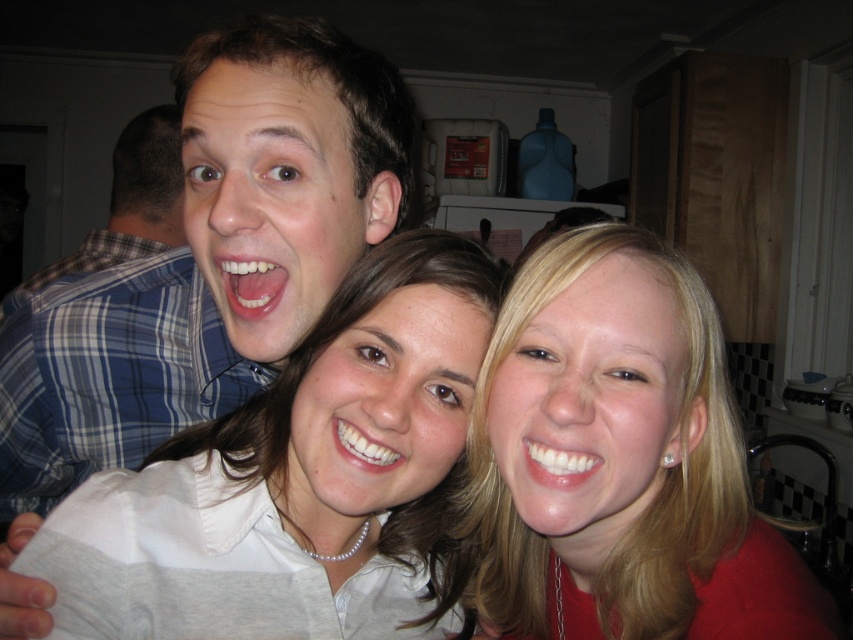
Question: From the image, what is the correct spatial relationship of white pearl necklace at center in relation to blue plaid shirt at left?

Choices:
 (A) below
 (B) above

Answer: (A)

Question: Which of the following is the farthest from the observer?

Choices:
 (A) (119, 228)
 (B) (115, 371)
 (C) (563, 289)
 (D) (437, 492)

Answer: (A)

Question: Is white matte shirt at upper left above white pearl necklace at center?

Choices:
 (A) no
 (B) yes

Answer: (B)

Question: Which object is positioned closest to the white pearl necklace at center?

Choices:
 (A) blonde hair at center
 (B) white matte shirt at upper left

Answer: (A)

Question: Is blonde hair at center closer to camera compared to white matte shirt at upper left?

Choices:
 (A) yes
 (B) no

Answer: (A)

Question: Which point appears closest to the camera in this image?

Choices:
 (A) (154, 125)
 (B) (624, 445)
 (C) (383, 470)

Answer: (B)